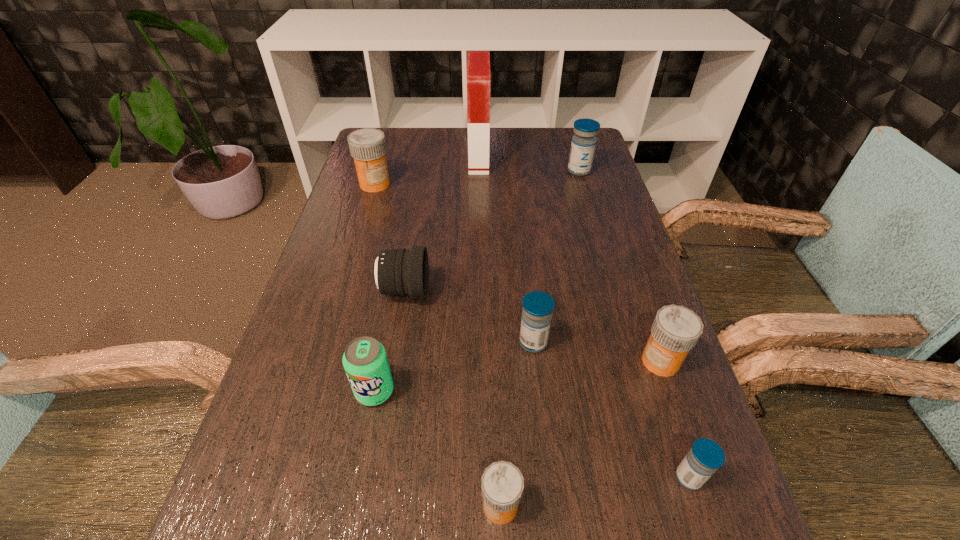
Locate an element on the screen. This screenshot has width=960, height=540. pop soda that is at the left edge is located at coordinates (365, 361).

You are a GUI agent. You are given a task and a screenshot of the screen. Output one action in this format:
    pyautogui.click(x=<x>, y=<y>)
    Task: Click on the telephoto lens at the left edge
    
    Given the screenshot: What is the action you would take?
    pyautogui.click(x=395, y=272)

In the image, there is a desktop. Where is `free space at the far edge`? The width and height of the screenshot is (960, 540). free space at the far edge is located at coordinates (511, 152).

The image size is (960, 540). I want to click on vacant space at the left edge, so click(314, 359).

Where is `free space at the right edge of the desktop`? The height and width of the screenshot is (540, 960). free space at the right edge of the desktop is located at coordinates (605, 171).

Find the location of a particular element. Image resolution: width=960 pixels, height=540 pixels. free space at the far right corner of the desktop is located at coordinates (549, 136).

Find the location of a particular element. The width and height of the screenshot is (960, 540). free spot between the smallest orange medicine and the cigarette_case is located at coordinates (490, 332).

At what (x,y) coordinates should I click in order to perform the action: click on vacant space in between the telephoto lens and the biggest blue medicine. Please return your answer as a coordinate pair (x, y). Looking at the image, I should click on [x=492, y=231].

Where is `vacant area that lies between the fifth medicine from right to left and the pop soda`? Image resolution: width=960 pixels, height=540 pixels. vacant area that lies between the fifth medicine from right to left and the pop soda is located at coordinates (438, 448).

Where is `vacant area between the biggest blue medicine and the pop soda`? vacant area between the biggest blue medicine and the pop soda is located at coordinates (477, 281).